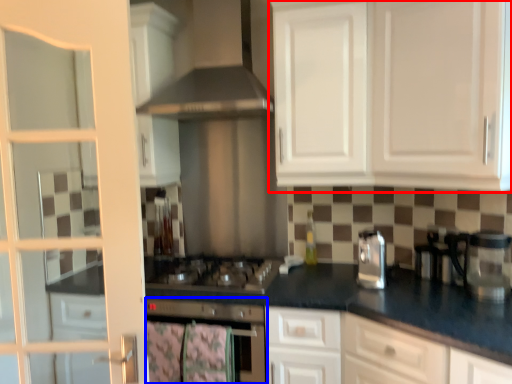
Question: Which of the following is the farthest to the observer, cabinetry (highlighted by a red box) or home appliance (highlighted by a blue box)?

Choices:
 (A) cabinetry
 (B) home appliance

Answer: (B)